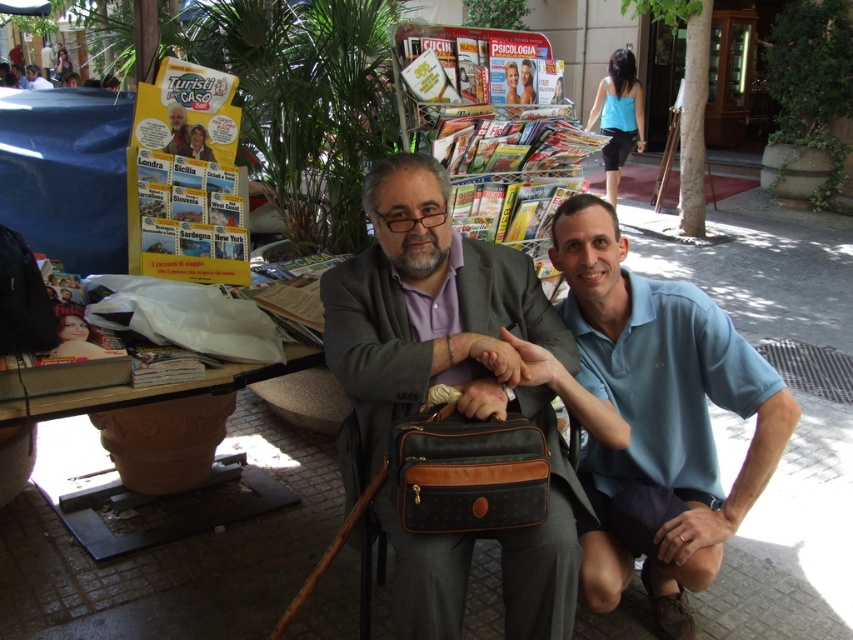
Question: Which point is closer to the camera?

Choices:
 (A) (181, 116)
 (B) (624, 394)

Answer: (B)

Question: Observing the image, what is the correct spatial positioning of light blue cotton polo shirt at lower right in reference to brown textured briefcase at center?

Choices:
 (A) above
 (B) below

Answer: (A)

Question: Is matte black bag at center positioned behind light blue shirt at center?

Choices:
 (A) no
 (B) yes

Answer: (A)

Question: Does light blue cotton polo shirt at lower right have a lesser width compared to brown textured briefcase at center?

Choices:
 (A) yes
 (B) no

Answer: (B)

Question: Which object is farther from the camera taking this photo?

Choices:
 (A) light blue cotton polo shirt at lower right
 (B) matte black bag at center
 (C) light blue shirt at center

Answer: (C)

Question: Which of the following is the farthest from the observer?

Choices:
 (A) matte black magazine at upper left
 (B) matte black bag at center
 (C) light blue shirt at center

Answer: (C)